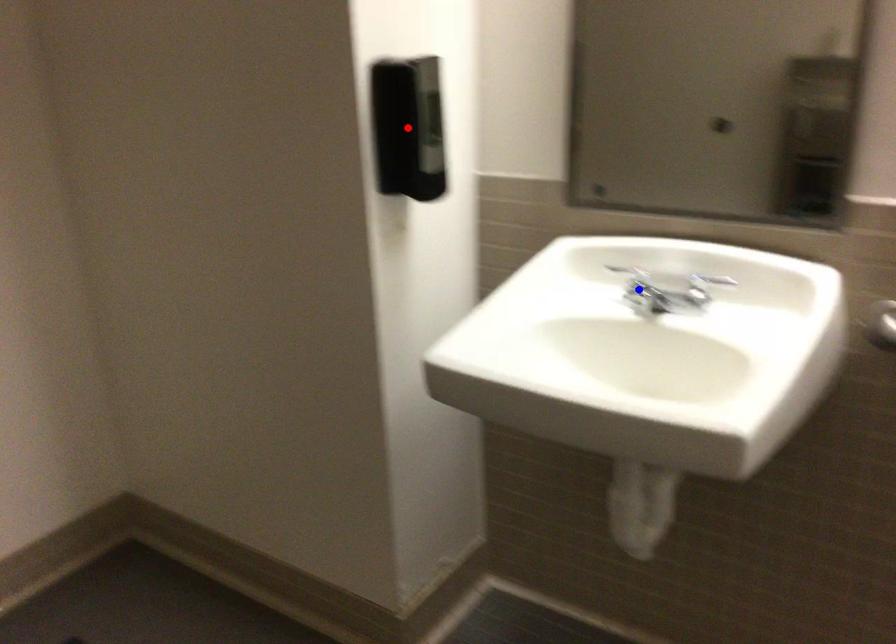
Question: Which of the two points in the image is closer to the camera?

Choices:
 (A) Blue point is closer.
 (B) Red point is closer.

Answer: (B)